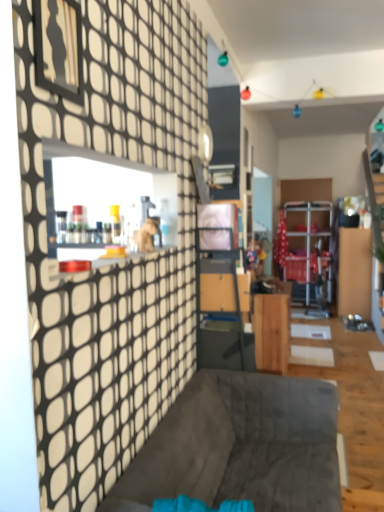
Question: Does dark gray fabric couch at center appear on the left side of wooden cabinet at center?

Choices:
 (A) no
 (B) yes

Answer: (B)

Question: Can you confirm if dark gray fabric couch at center is bigger than wooden cabinet at center?

Choices:
 (A) no
 (B) yes

Answer: (B)

Question: Does dark gray fabric couch at center have a greater height compared to wooden cabinet at center?

Choices:
 (A) yes
 (B) no

Answer: (B)

Question: Is dark gray fabric couch at center smaller than wooden cabinet at center?

Choices:
 (A) no
 (B) yes

Answer: (A)

Question: From a real-world perspective, is dark gray fabric couch at center under wooden cabinet at center?

Choices:
 (A) yes
 (B) no

Answer: (A)

Question: Does dark gray fabric couch at center come behind wooden cabinet at center?

Choices:
 (A) no
 (B) yes

Answer: (A)

Question: Does wooden cabinet at center turn towards dark gray fabric couch at center?

Choices:
 (A) no
 (B) yes

Answer: (A)

Question: Considering the relative sizes of wooden cabinet at center and dark gray fabric couch at center in the image provided, is wooden cabinet at center wider than dark gray fabric couch at center?

Choices:
 (A) yes
 (B) no

Answer: (B)

Question: Is wooden cabinet at center oriented away from dark gray fabric couch at center?

Choices:
 (A) yes
 (B) no

Answer: (B)

Question: From the image's perspective, does wooden cabinet at center appear higher than dark gray fabric couch at center?

Choices:
 (A) no
 (B) yes

Answer: (B)

Question: Is wooden cabinet at center placed right next to dark gray fabric couch at center?

Choices:
 (A) no
 (B) yes

Answer: (A)

Question: Is wooden cabinet at center thinner than dark gray fabric couch at center?

Choices:
 (A) yes
 (B) no

Answer: (A)

Question: Considering their positions, is dark gray fabric couch at center located in front of or behind wooden cabinet at center?

Choices:
 (A) behind
 (B) front

Answer: (B)